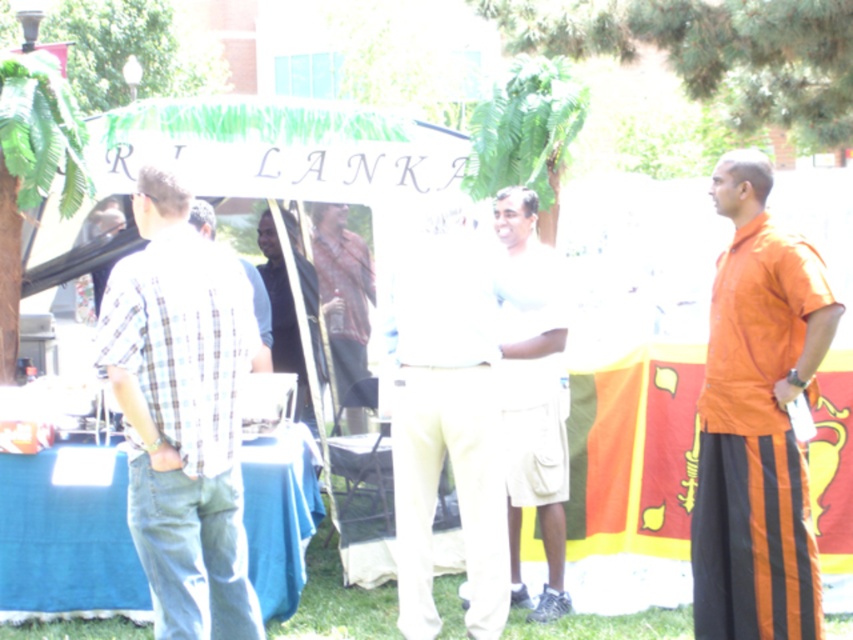
Question: Which is nearer to the white cotton shirt at center?

Choices:
 (A) blue fabric tablecloth at lower left
 (B) checkered fabric shirt at center
 (C) brown leather jacket at center

Answer: (C)

Question: Is plaid shirt at left wider than white cotton shirt at center?

Choices:
 (A) no
 (B) yes

Answer: (B)

Question: Considering the relative positions of white cotton shirt at center and checkered fabric shirt at center in the image provided, where is white cotton shirt at center located with respect to checkered fabric shirt at center?

Choices:
 (A) above
 (B) below

Answer: (B)

Question: Which object appears farthest from the camera in this image?

Choices:
 (A) checkered fabric shirt at center
 (B) orange cotton kurta at right
 (C) plaid shirt at left

Answer: (A)

Question: Considering the relative positions of plaid shirt at left and blue fabric tablecloth at lower left in the image provided, where is plaid shirt at left located with respect to blue fabric tablecloth at lower left?

Choices:
 (A) left
 (B) right

Answer: (B)

Question: Considering the real-world distances, which object is closest to the orange cotton kurta at right?

Choices:
 (A) white cotton shirt at center
 (B) blue fabric tablecloth at lower left
 (C) light beige cotton pants at center

Answer: (A)